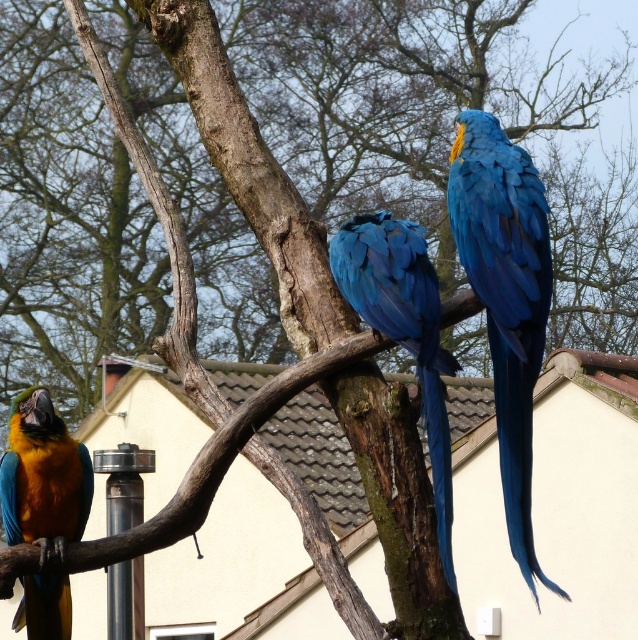
Is point (336, 272) farther from viewer compared to point (47, 429)?

No, it is not.

Who is positioned more to the left, blue glossy parrot at center or matte blue parrot at left?

From the viewer's perspective, matte blue parrot at left appears more on the left side.

Is point (436, 419) positioned behind point (41, 461)?

No.

Where is `blue glossy parrot at center`? This screenshot has width=638, height=640. blue glossy parrot at center is located at coordinates (403, 330).

Can you confirm if blue glossy parrot at upper right is bigger than matte blue parrot at left?

Yes, blue glossy parrot at upper right is bigger than matte blue parrot at left.

Image resolution: width=638 pixels, height=640 pixels. What are the coordinates of `blue glossy parrot at upper right` in the screenshot? It's located at (505, 298).

Find the location of `blue glossy parrot at upper right`. blue glossy parrot at upper right is located at coordinates (505, 298).

Can you confirm if blue glossy parrot at upper right is bigger than blue glossy parrot at center?

Yes.

I want to click on blue glossy parrot at upper right, so click(x=505, y=298).